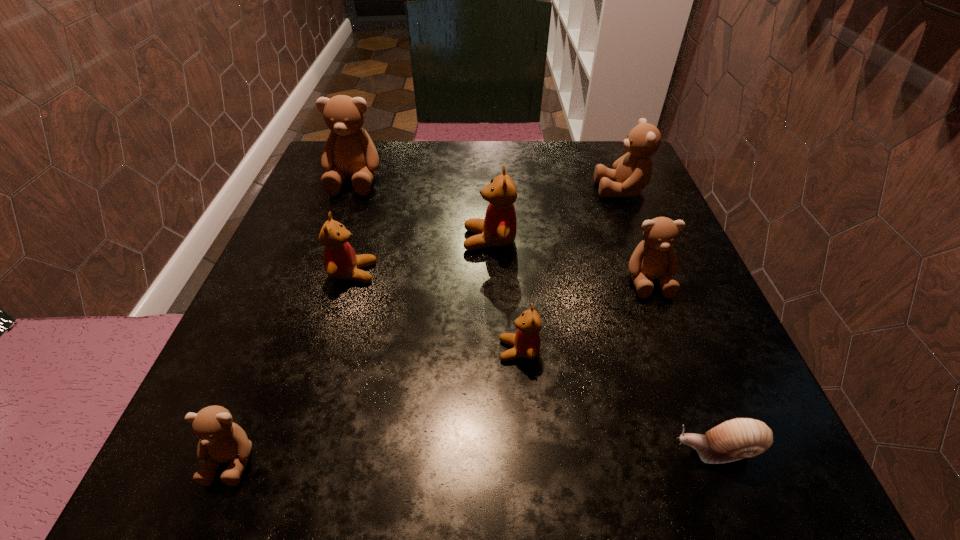
Find the location of a particular element. The image size is (960, 540). free space between the second smallest brown teddy bear and the nearest brown teddy bear is located at coordinates (440, 370).

You are a GUI agent. You are given a task and a screenshot of the screen. Output one action in this format:
    pyautogui.click(x=<x>, y=<y>)
    Task: Click on the free space between the nearest teddy bear and the third smallest brown teddy bear
    Image resolution: width=960 pixels, height=540 pixels.
    Given the screenshot: What is the action you would take?
    pyautogui.click(x=426, y=325)

Identify the location of vacant area between the biggest red teddy bear and the third smallest brown teddy bear. The height and width of the screenshot is (540, 960). (556, 215).

The width and height of the screenshot is (960, 540). I want to click on vacant space that's between the shortest object and the second smallest brown teddy bear, so click(x=683, y=366).

Identify the location of free space between the smallest brown teddy bear and the second nearest brown teddy bear. The width and height of the screenshot is (960, 540). (440, 370).

Find the location of `free space between the leftmost red teddy bear and the second nearest teddy bear`. free space between the leftmost red teddy bear and the second nearest teddy bear is located at coordinates (436, 312).

Where is `the sixth closest object to the biggest red teddy bear`? the sixth closest object to the biggest red teddy bear is located at coordinates (x=739, y=438).

The height and width of the screenshot is (540, 960). Identify the location of object that is the second closest to the second nearest brown teddy bear. (632, 172).

Identify which teddy bear is located as the second nearest to the third smallest brown teddy bear. Please provide its 2D coordinates. Your answer should be formatted as a tuple, i.e. [(x, y)], where the tuple contains the x and y coordinates of a point satisfying the conditions above.

[(499, 227)]

This screenshot has height=540, width=960. Identify the location of teddy bear that is the second closest to the biggest red teddy bear. (526, 341).